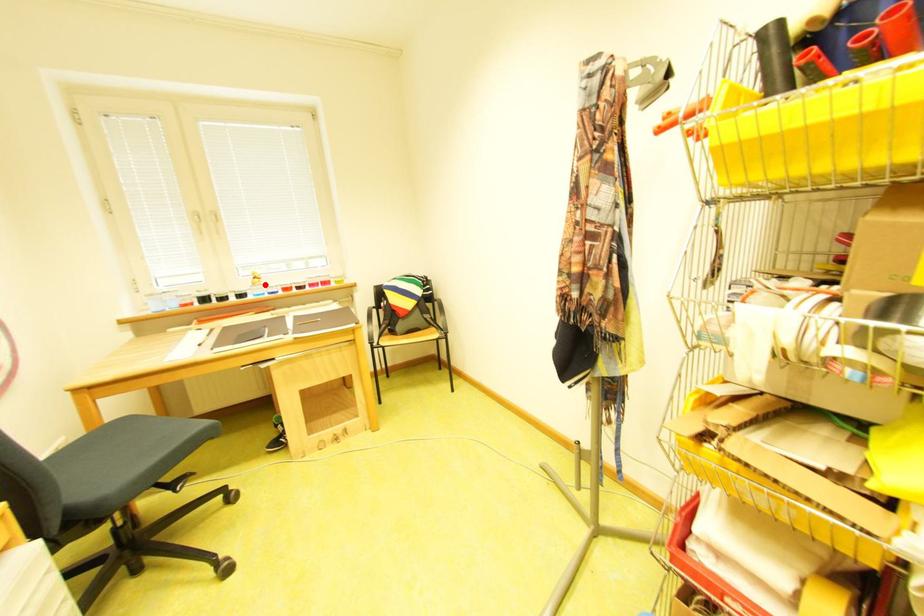
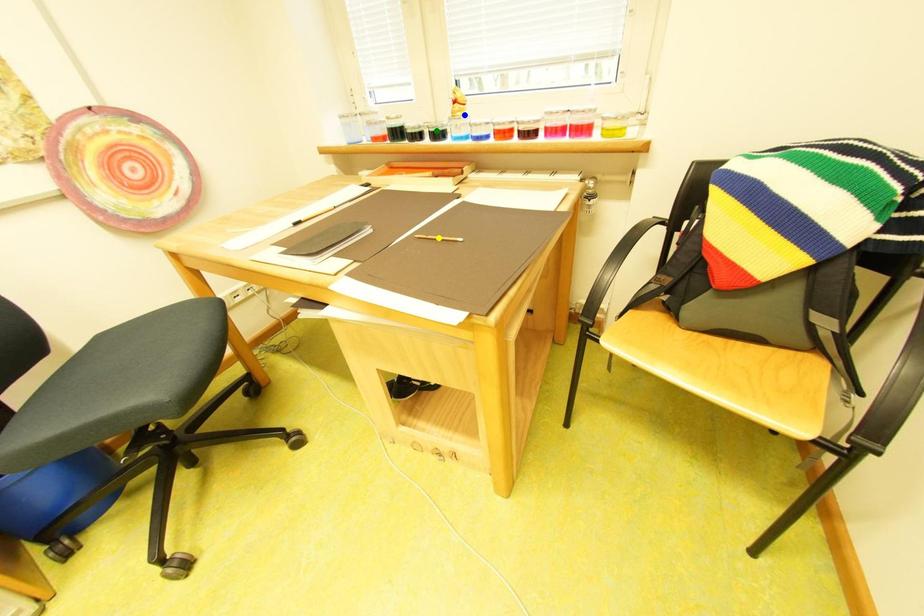
Question: I am providing you with two images of the same scene from different viewpoints. A red point is marked on the first image. You are given multiple points on the second image. Which point in image 2 represents the same 3d spot as the red point in image 1?

Choices:
 (A) yellow point
 (B) blue point
 (C) green point

Answer: (B)